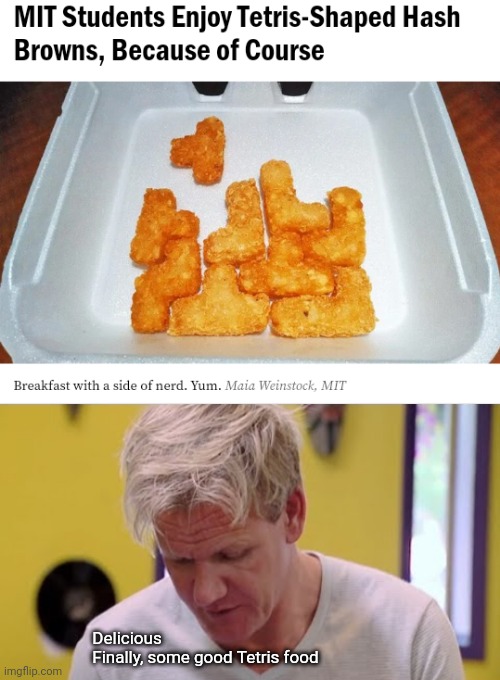
Find the location of a particular element. This screenshot has height=680, width=500. window frame is located at coordinates (407, 541), (482, 545), (465, 653).